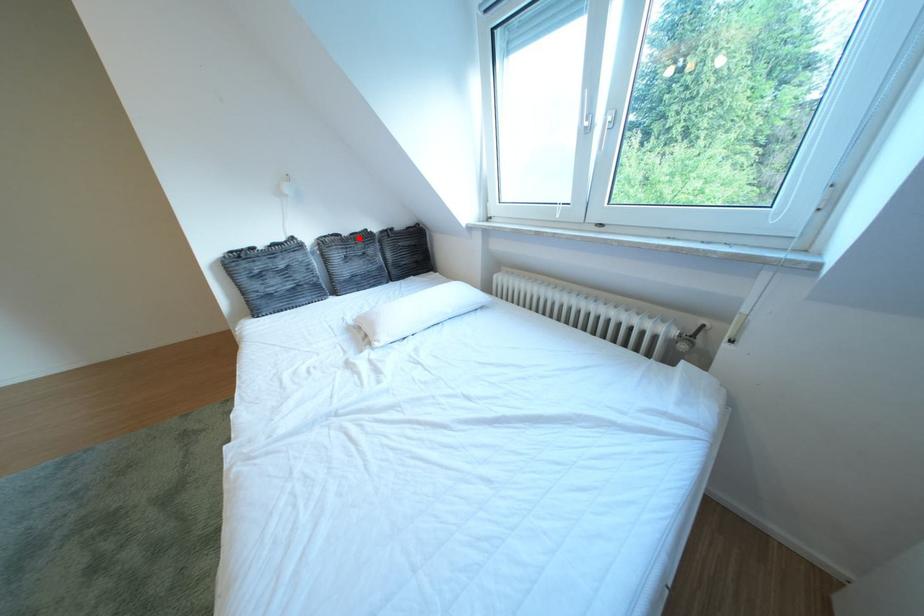
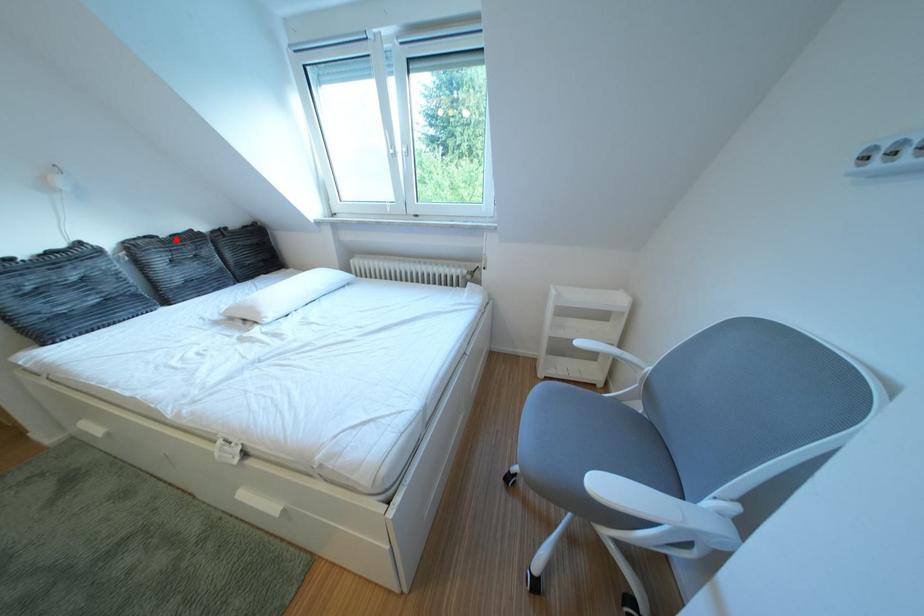
I am providing you with two images of the same scene from different viewpoints. A red point is marked on the first image and another point is marked on the second image. Is the red point in image1 aligned with the point shown in image2?

Yes